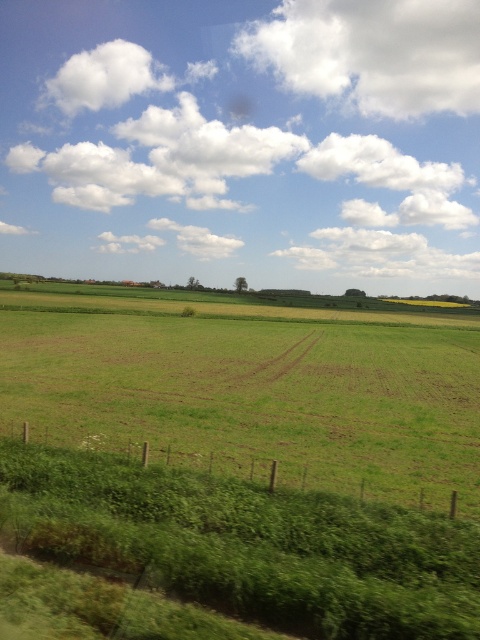
In the scene shown: Is green grassy field at center positioned behind green leafy grass at lower left?

That is True.

Can you confirm if green grassy field at center is wider than green leafy grass at lower left?

Yes.

Identify the location of green grassy field at center. The image size is (480, 640). (251, 387).

Locate an element on the screen. green grassy field at center is located at coordinates (251, 387).